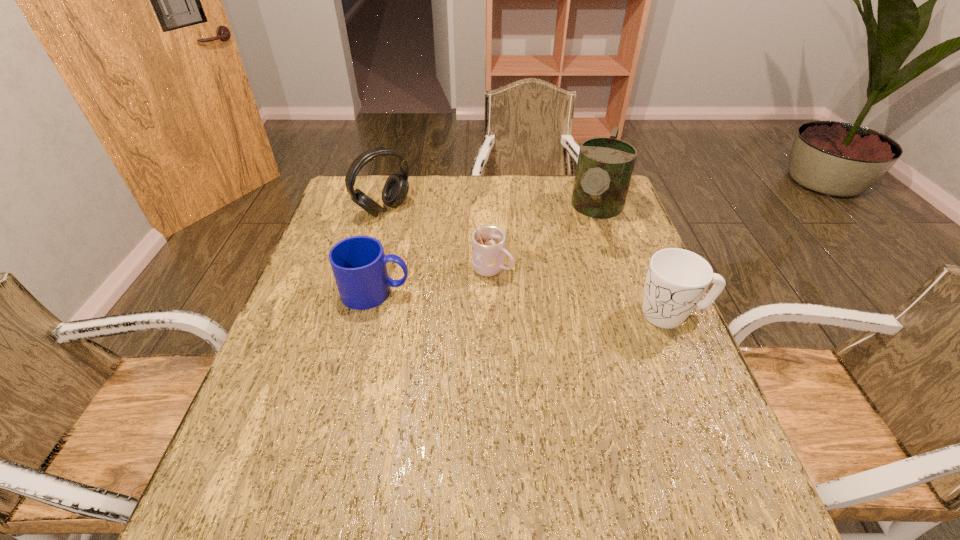
This screenshot has height=540, width=960. Find the location of `vacant position located 0.130m on the earcups of the headset`. vacant position located 0.130m on the earcups of the headset is located at coordinates (424, 240).

At what (x,y) coordinates should I click in order to perform the action: click on free point located on the earcups of the headset. Please return your answer as a coordinate pair (x, y). Looking at the image, I should click on (462, 270).

Where is `vacant region located 0.250m on the side with the handle of the cup`? The image size is (960, 540). vacant region located 0.250m on the side with the handle of the cup is located at coordinates (594, 322).

The height and width of the screenshot is (540, 960). I want to click on free location located 0.260m on the side with the handle of the cup, so click(598, 324).

Locate an element on the screen. The image size is (960, 540). free region located 0.070m on the side with the handle of the cup is located at coordinates (531, 289).

Identify the location of vacant space located with the spout on the watering can. This screenshot has width=960, height=540. (571, 320).

Locate an element on the screen. The image size is (960, 540). free space located with the spout on the watering can is located at coordinates (564, 345).

Identify the location of free space located 0.150m with the spout on the watering can. Image resolution: width=960 pixels, height=540 pixels. (583, 282).

Image resolution: width=960 pixels, height=540 pixels. I want to click on headset positioned at the far edge, so click(395, 190).

Identify the location of watering can located at the far edge. (605, 165).